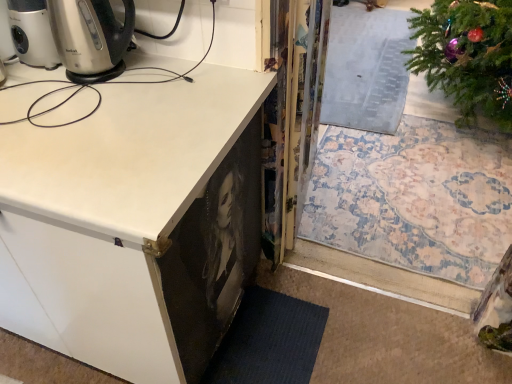
Question: Is transparent plastic screen door at center further to the viewer compared to white matte cabinet at lower left?

Choices:
 (A) no
 (B) yes

Answer: (B)

Question: From a real-world perspective, is transparent plastic screen door at center physically above white matte cabinet at lower left?

Choices:
 (A) no
 (B) yes

Answer: (A)

Question: Considering the relative sizes of transparent plastic screen door at center and white matte cabinet at lower left in the image provided, is transparent plastic screen door at center bigger than white matte cabinet at lower left?

Choices:
 (A) no
 (B) yes

Answer: (A)

Question: Can you confirm if transparent plastic screen door at center is positioned to the right of white matte cabinet at lower left?

Choices:
 (A) yes
 (B) no

Answer: (A)

Question: Does transparent plastic screen door at center have a greater height compared to white matte cabinet at lower left?

Choices:
 (A) yes
 (B) no

Answer: (B)

Question: From the image's perspective, is transparent plastic screen door at center below white matte cabinet at lower left?

Choices:
 (A) yes
 (B) no

Answer: (B)

Question: Is white matte cabinet at lower left smaller than transparent plastic screen door at center?

Choices:
 (A) yes
 (B) no

Answer: (B)

Question: Is white matte cabinet at lower left not within transparent plastic screen door at center?

Choices:
 (A) yes
 (B) no

Answer: (A)

Question: Is white matte cabinet at lower left thinner than transparent plastic screen door at center?

Choices:
 (A) no
 (B) yes

Answer: (A)

Question: Is white matte cabinet at lower left turned away from transparent plastic screen door at center?

Choices:
 (A) yes
 (B) no

Answer: (A)

Question: Considering the relative sizes of white matte cabinet at lower left and transparent plastic screen door at center in the image provided, is white matte cabinet at lower left bigger than transparent plastic screen door at center?

Choices:
 (A) yes
 (B) no

Answer: (A)

Question: Does white matte cabinet at lower left lie behind transparent plastic screen door at center?

Choices:
 (A) no
 (B) yes

Answer: (A)

Question: Looking at their shapes, would you say white matte cabinet at lower left is wider or thinner than transparent plastic screen door at center?

Choices:
 (A) thin
 (B) wide

Answer: (B)